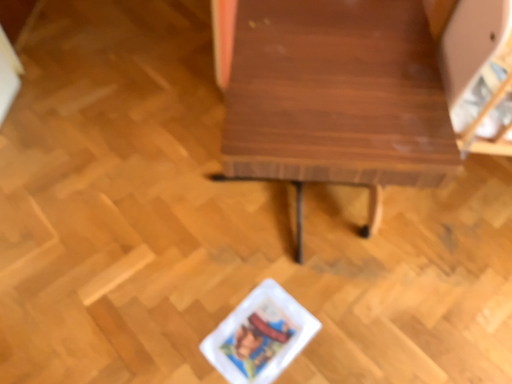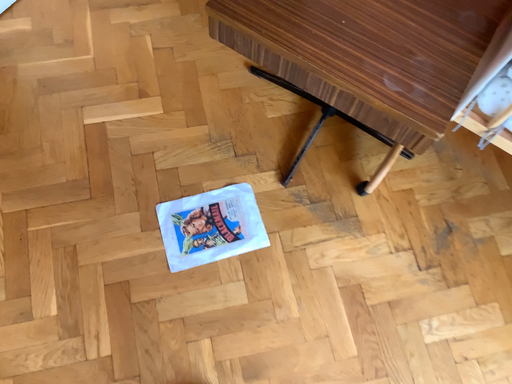
Question: Which way did the camera rotate in the video?

Choices:
 (A) rotated downward
 (B) rotated upward

Answer: (A)